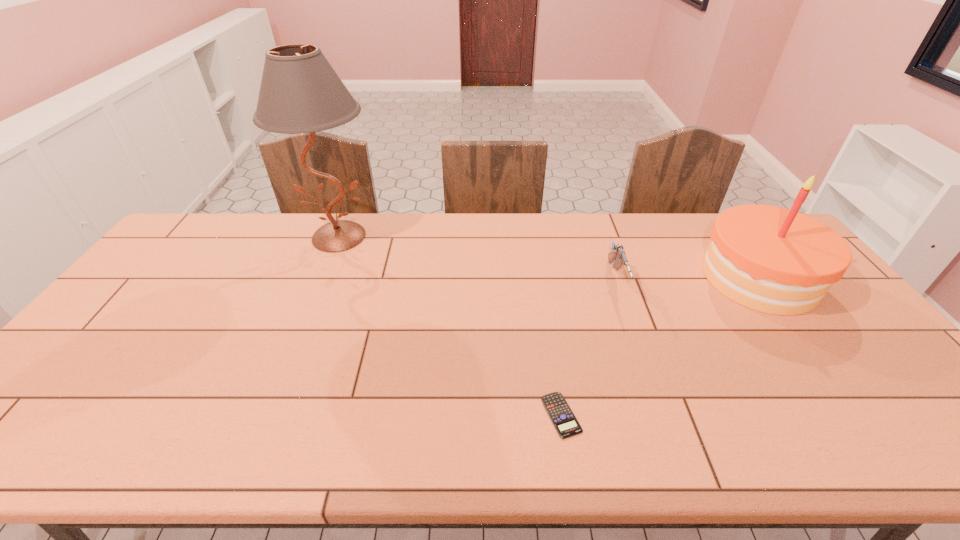
The width and height of the screenshot is (960, 540). What are the coordinates of `vacant space that's between the birthday cake and the calculator` in the screenshot? It's located at (660, 346).

Find the location of a particular element. Image resolution: width=960 pixels, height=540 pixels. vacant area that lies between the tallest object and the birthday cake is located at coordinates (549, 257).

Locate which object is the closest to the leftmost object. Please provide its 2D coordinates. Your answer should be formatted as a tuple, i.e. [(x, y)], where the tuple contains the x and y coordinates of a point satisfying the conditions above.

[(557, 408)]

I want to click on object that is the third closest to the table lamp, so click(770, 259).

This screenshot has width=960, height=540. Find the location of `free point that satisfies the following two spatial constraints: 1. on the front-facing side of the birthday cake; 2. on the left side of the table lamp`. free point that satisfies the following two spatial constraints: 1. on the front-facing side of the birthday cake; 2. on the left side of the table lamp is located at coordinates (323, 278).

Where is `vacant area that satisfies the following two spatial constraints: 1. on the front-facing side of the second tallest object; 2. on the right side of the table lamp`? vacant area that satisfies the following two spatial constraints: 1. on the front-facing side of the second tallest object; 2. on the right side of the table lamp is located at coordinates (323, 278).

Where is `blank area in the image that satisfies the following two spatial constraints: 1. on the back side of the calculator; 2. on the left side of the second tallest object`? This screenshot has width=960, height=540. blank area in the image that satisfies the following two spatial constraints: 1. on the back side of the calculator; 2. on the left side of the second tallest object is located at coordinates (540, 278).

This screenshot has width=960, height=540. I want to click on free space in the image that satisfies the following two spatial constraints: 1. on the front-facing side of the third shortest object; 2. on the right side of the table lamp, so click(x=323, y=278).